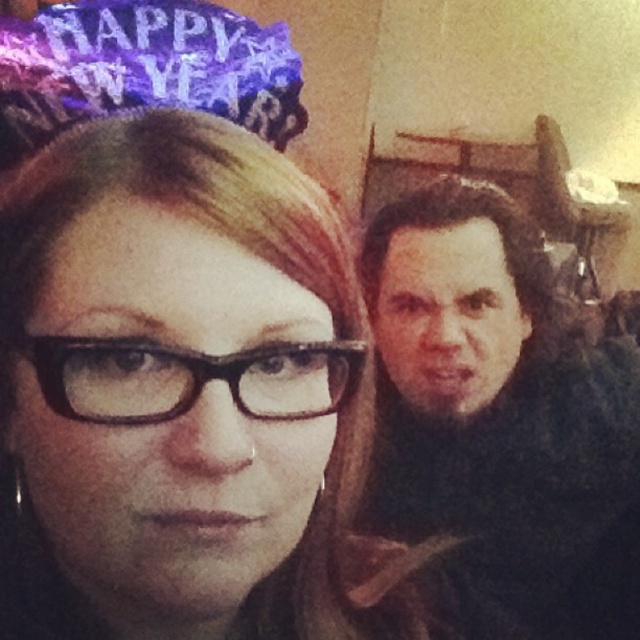
Looking at this image, you are trying to identify where the dark brown fur at right is located in the image. Based on the coordinates provided, can you determine its position relative to the center of the image?

The dark brown fur at right is located at coordinates point (500, 422), which places it to the right and slightly above the center of the image.

You are trying to decide which pair of glasses to wear for a casual evening out. You have both the matte black glasses at center and the black plastic glasses at center. Which pair would be more noticeable due to their size?

The matte black glasses at center are larger in size compared to the black plastic glasses at center, so they would be more noticeable.